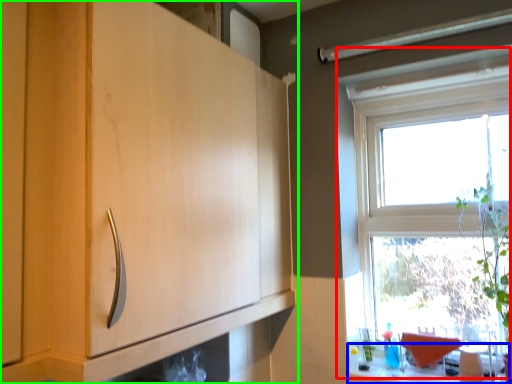
Question: Estimate the real-world distances between objects in this image. Which object is closer to window (highlighted by a red box), counter top (highlighted by a blue box) or cabinetry (highlighted by a green box)?

Choices:
 (A) counter top
 (B) cabinetry

Answer: (A)